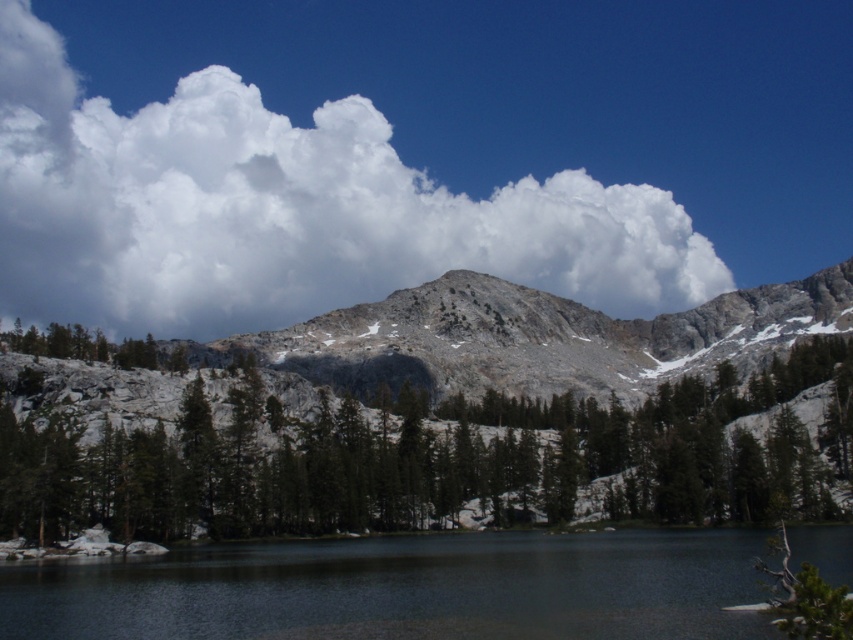
Question: Among these objects, which one is nearest to the camera?

Choices:
 (A) green matte tree at center
 (B) rocky gray mountain at center

Answer: (A)

Question: Does white fluffy cloud at upper center appear under smooth dark water at lower center?

Choices:
 (A) no
 (B) yes

Answer: (A)

Question: Is the position of green matte tree at center more distant than that of smooth dark water at lower center?

Choices:
 (A) no
 (B) yes

Answer: (B)

Question: Which of the following is the farthest from the observer?

Choices:
 (A) white fluffy cloud at upper center
 (B) smooth dark water at lower center
 (C) rocky gray mountain at center
 (D) green matte tree at center

Answer: (A)

Question: Which of these objects is positioned farthest from the smooth dark water at lower center?

Choices:
 (A) green matte tree at center
 (B) rocky gray mountain at center
 (C) white fluffy cloud at upper center

Answer: (C)

Question: Does green matte tree at center have a larger size compared to rocky gray mountain at center?

Choices:
 (A) no
 (B) yes

Answer: (A)